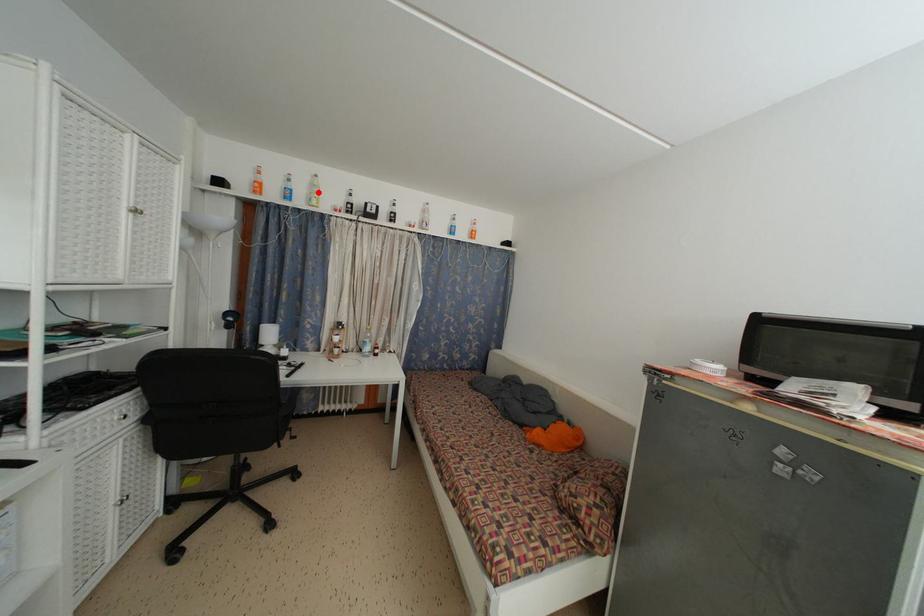
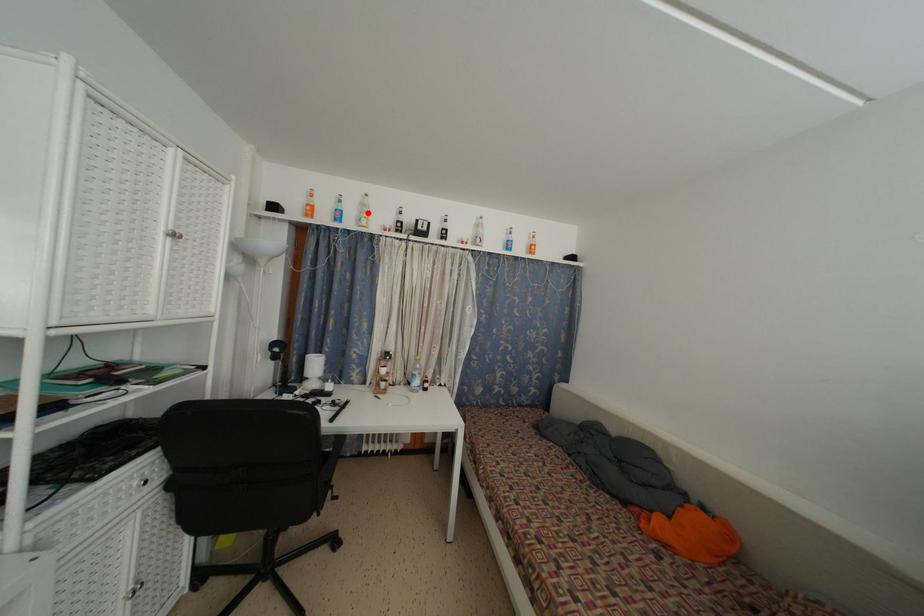
I am providing you with two images of the same scene from different viewpoints. A red point is marked on the first image and another point is marked on the second image. Do the highlighted points in image1 and image2 indicate the same real-world spot?

Yes